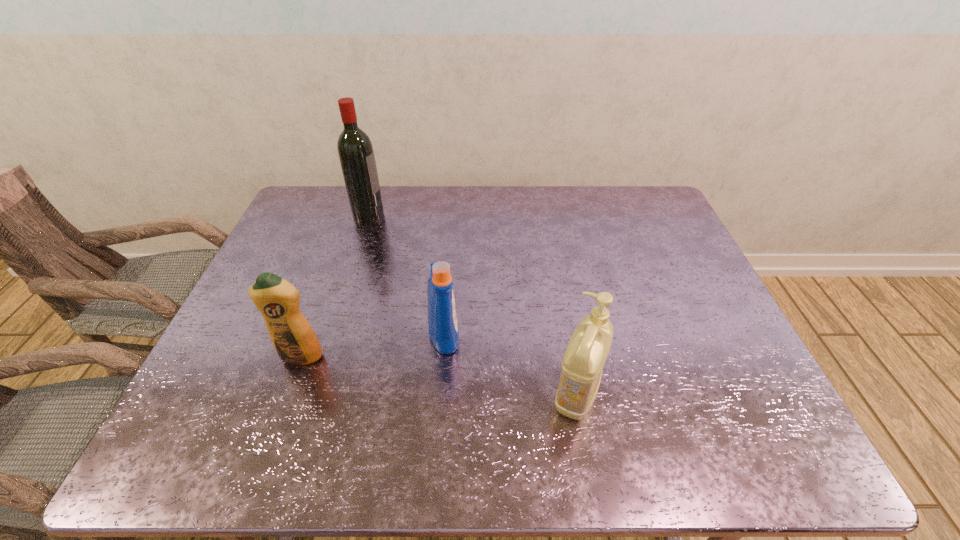
This screenshot has height=540, width=960. What are the coordinates of `vacant area between the second detergent from right to left and the rightmost detergent` in the screenshot? It's located at 511,364.

Locate an element on the screen. free spot between the leftmost detergent and the second detergent from left to right is located at coordinates (372, 345).

Identify the location of free spot between the leftmost detergent and the second detergent from right to left. (372, 345).

Where is `free space between the leftmost detergent and the second detergent from left to right`? free space between the leftmost detergent and the second detergent from left to right is located at coordinates (372, 345).

This screenshot has width=960, height=540. Identify the location of blank region between the leftmost detergent and the tallest object. (335, 286).

Image resolution: width=960 pixels, height=540 pixels. In order to click on free point between the second object from right to left and the tallest object in this screenshot , I will do `click(406, 275)`.

You are a GUI agent. You are given a task and a screenshot of the screen. Output one action in this format:
    pyautogui.click(x=<x>, y=<y>)
    Task: Click on the free space that is in between the wine bottle and the rightmost object
    This screenshot has width=960, height=540.
    Given the screenshot: What is the action you would take?
    pyautogui.click(x=472, y=305)

I want to click on vacant area that lies between the second detergent from left to right and the rightmost detergent, so click(511, 364).

Locate an element on the screen. The image size is (960, 540). the second closest object to the rightmost object is located at coordinates (292, 336).

This screenshot has height=540, width=960. What are the coordinates of `object that can be found as the second closest to the tallest object` in the screenshot? It's located at (292, 336).